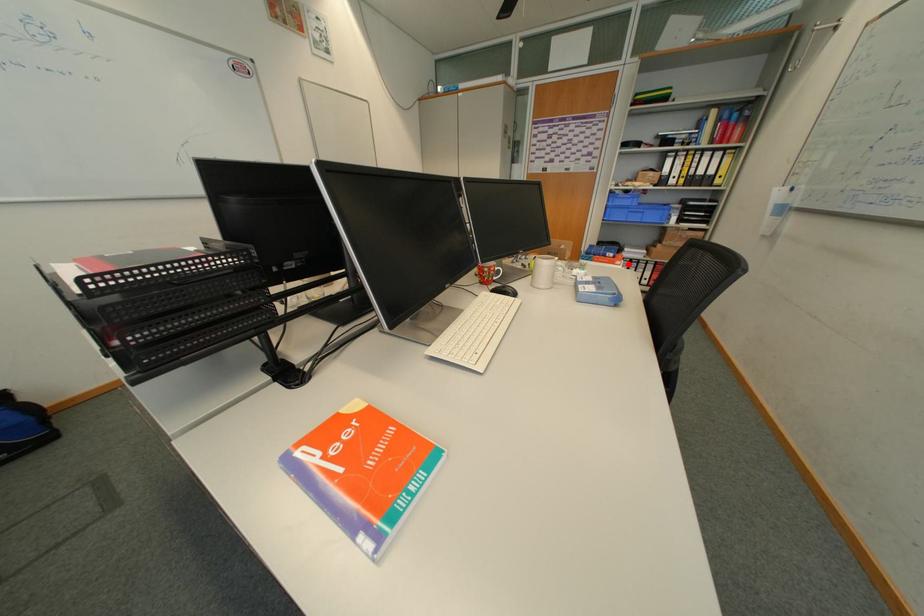
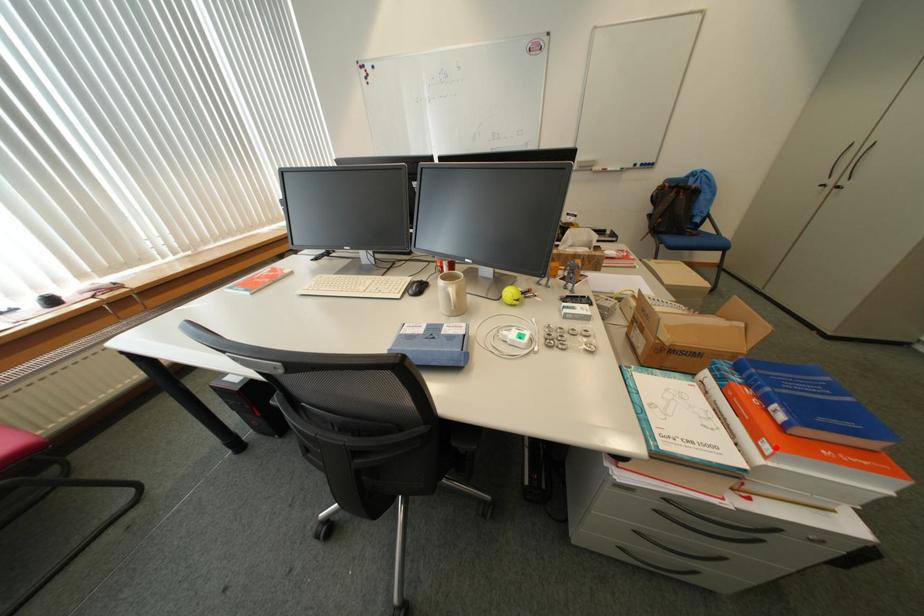
I am providing you with two images of the same scene from different viewpoints. A red point is marked on the first image and another point is marked on the second image. Does the point marked in image1 correspond to the same location as the one in image2?

Yes